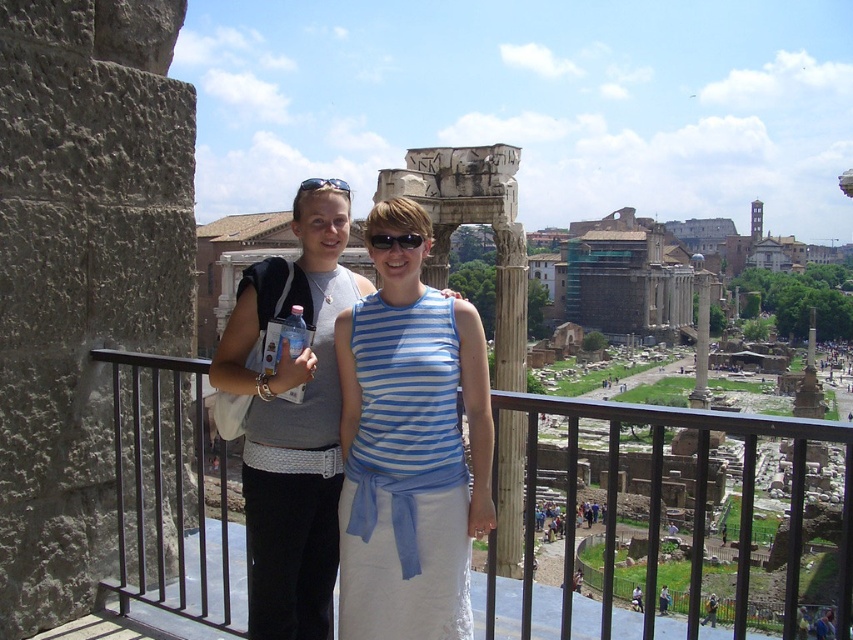
Is blue striped tank top at center closer to the viewer compared to matte gray tank top at center?

Yes.

Does blue striped tank top at center have a lesser width compared to matte gray tank top at center?

Yes.

Describe the element at coordinates (409, 448) in the screenshot. I see `blue striped tank top at center` at that location.

In order to click on blue striped tank top at center in this screenshot , I will do `click(409, 448)`.

Is black metal railing at center bigger than black plastic sunglasses at center?

Yes, black metal railing at center is bigger than black plastic sunglasses at center.

Does black metal railing at center appear under black plastic sunglasses at center?

Yes.

Find the location of a particular element. This screenshot has width=853, height=640. black metal railing at center is located at coordinates (160, 484).

Is matte gray tank top at center bigger than wooden column at center?

Correct, matte gray tank top at center is larger in size than wooden column at center.

Can you confirm if matte gray tank top at center is smaller than wooden column at center?

Actually, matte gray tank top at center might be larger than wooden column at center.

Does point (291, 588) come farther from viewer compared to point (503, 248)?

No, it is not.

Find the location of a particular element. The width and height of the screenshot is (853, 640). matte gray tank top at center is located at coordinates (292, 422).